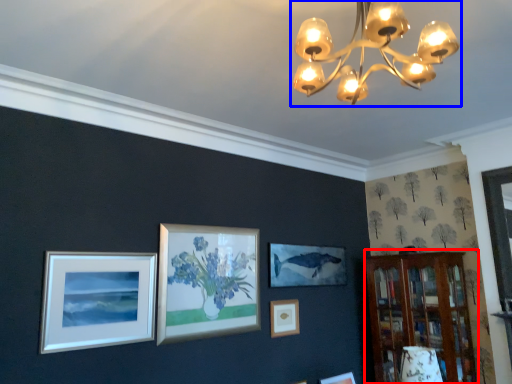
Question: Which of the following is the closest to the observer, bookshelf (highlighted by a red box) or lamp (highlighted by a blue box)?

Choices:
 (A) bookshelf
 (B) lamp

Answer: (B)